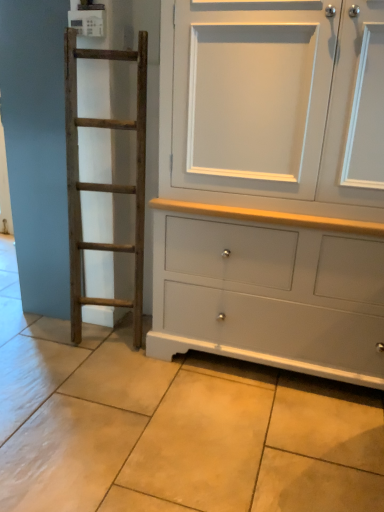
Find the location of a particular element. This screenshot has height=512, width=384. vacant region in front of white painted wood chest of drawers at center is located at coordinates (251, 434).